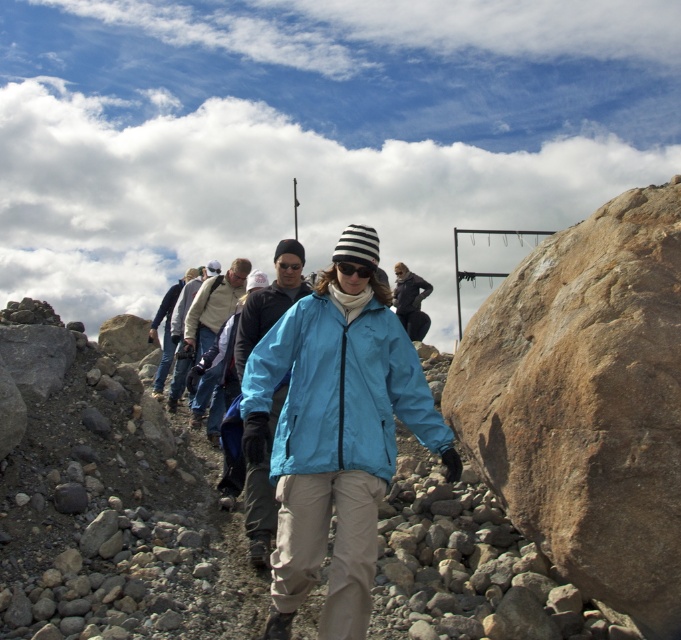
You are a photographer trying to capture a photo of the group of hikers. You notice two points marked in the scene at coordinates point (279, 380) and point (370, 276). Which point should you focus on to ensure the hikers in the foreground are in sharp focus?

You should focus on point 0.594, 010 because it is closer to the camera than point (370, 276), ensuring the foreground hikers are in focus.

You are a hiker trying to navigate through the rocky terrain. You see two points marked in the image. The first point is at coordinate point (644, 348) and the second is at point (364, 276). Which point should you aim for first if you want to reach the second point without backtracking?

You should aim for point (644, 348) first because it is in front of point (364, 276), so reaching it first allows you to proceed towards the second point without needing to backtrack.